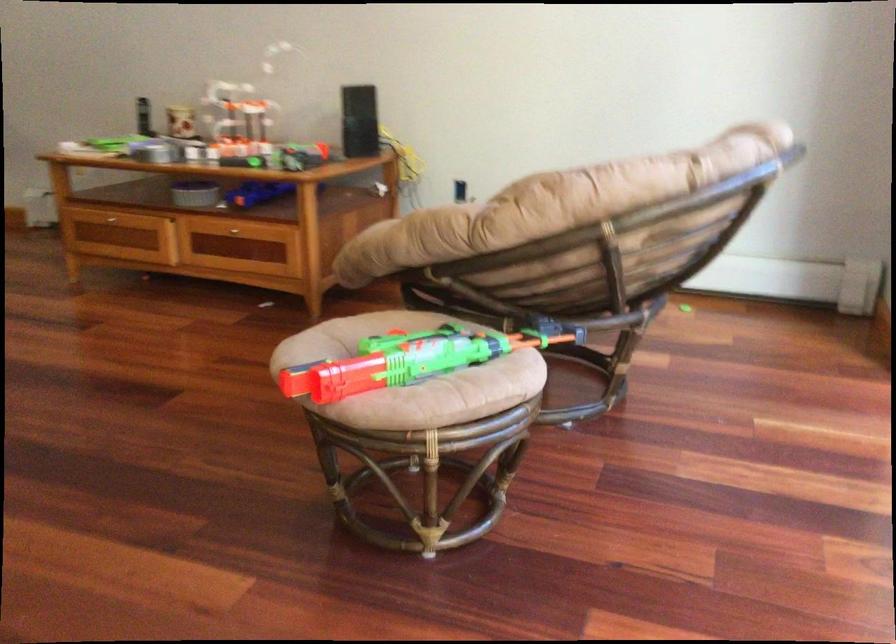
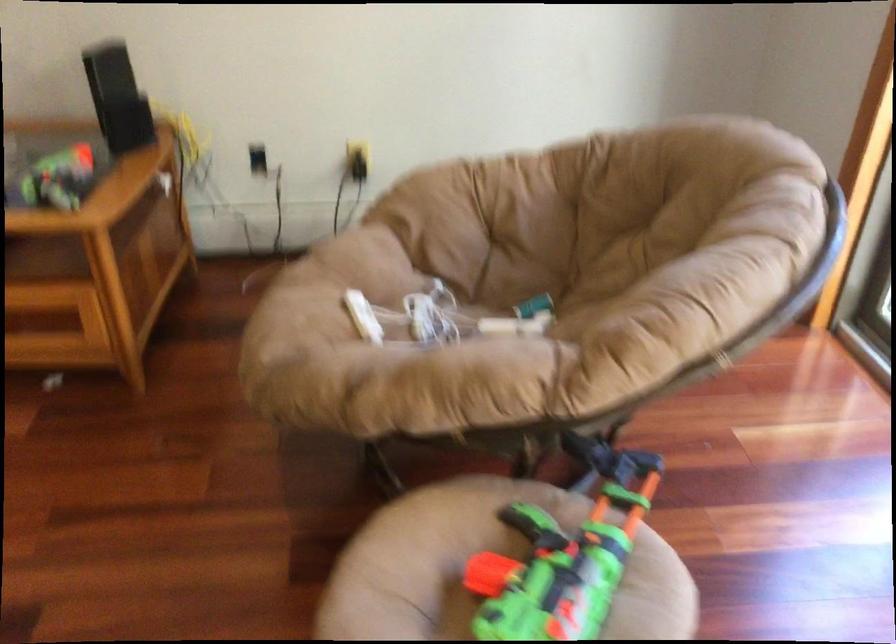
Locate, in the second image, the point that corresponds to point (440, 327) in the first image.

(564, 554)